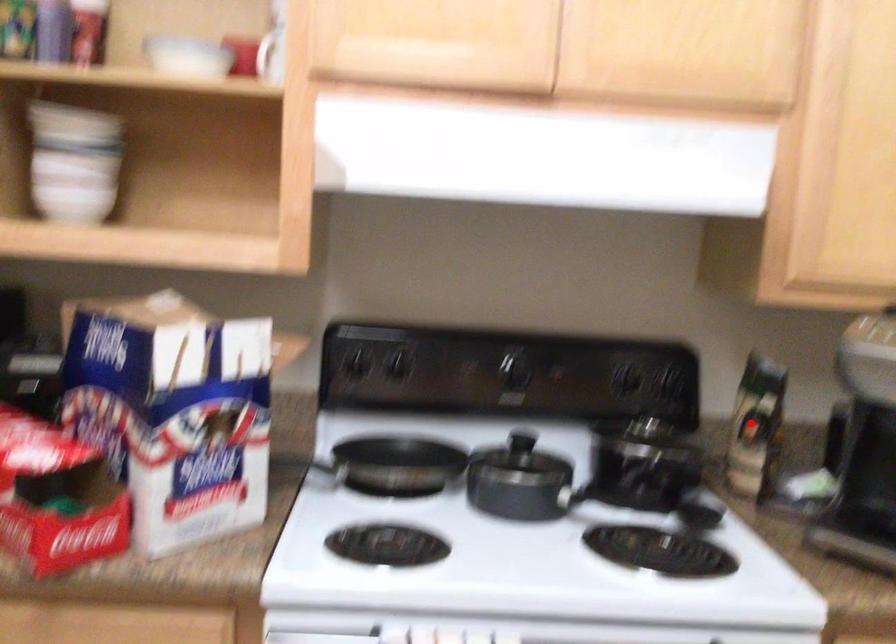
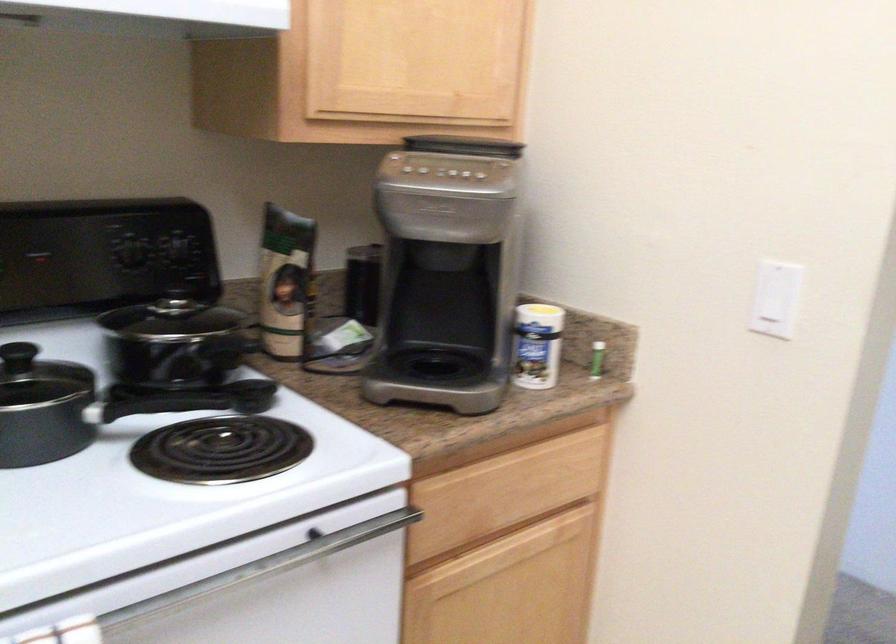
Question: I am providing you with two images of the same scene from different viewpoints. A red point is marked on the first image. At the location where the point appears in image 1, is it still visible in image 2?

Choices:
 (A) Yes
 (B) No

Answer: (A)